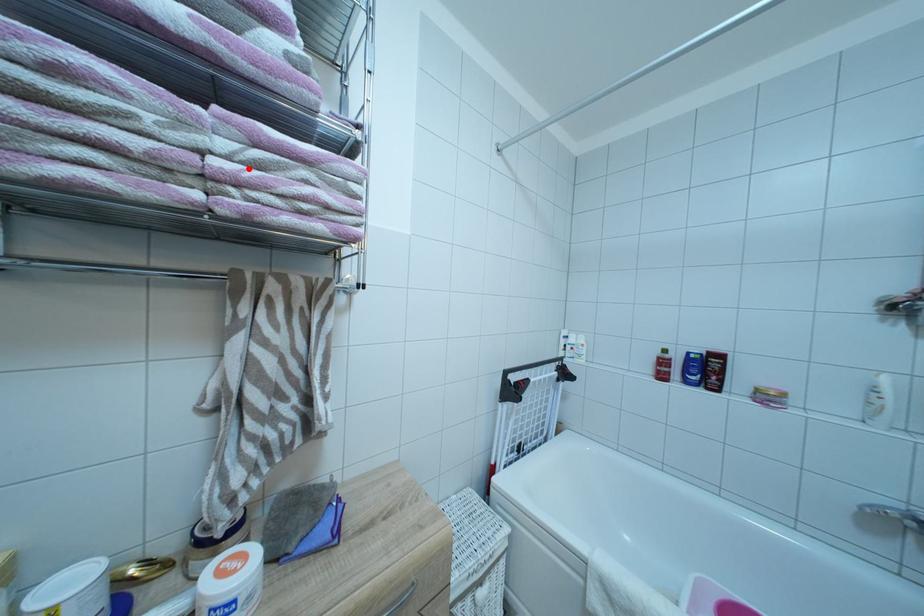
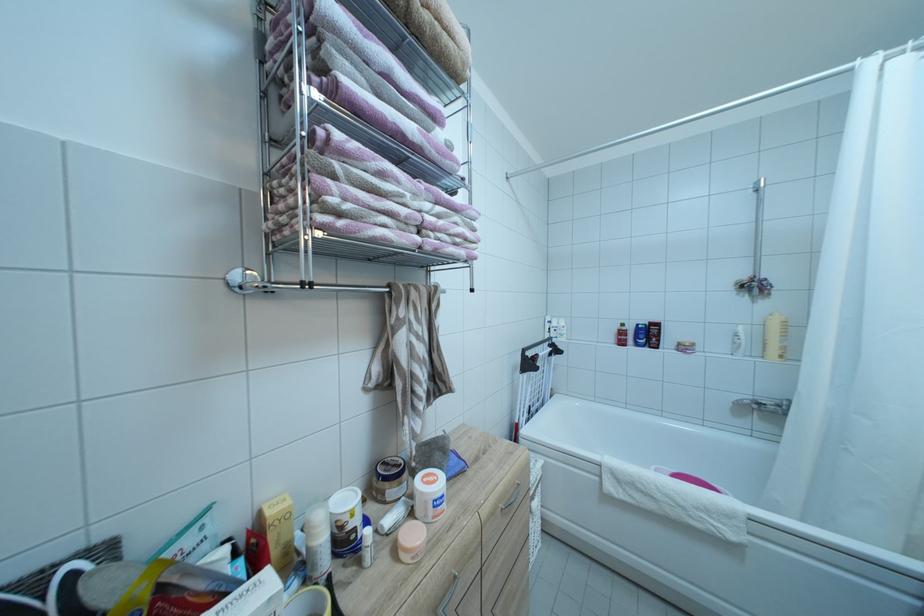
Locate, in the second image, the point that corresponds to the highlighted location in the first image.

(440, 221)